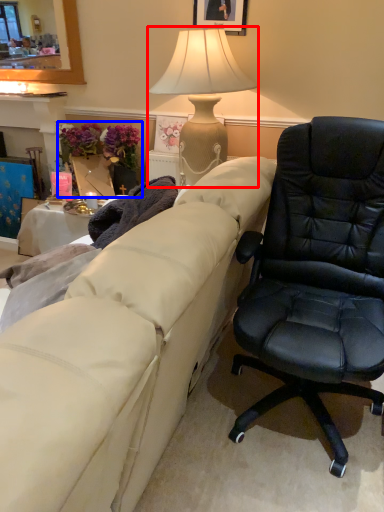
Question: Among these objects, which one is nearest to the camera, lamp (highlighted by a red box) or houseplant (highlighted by a blue box)?

Choices:
 (A) lamp
 (B) houseplant

Answer: (A)